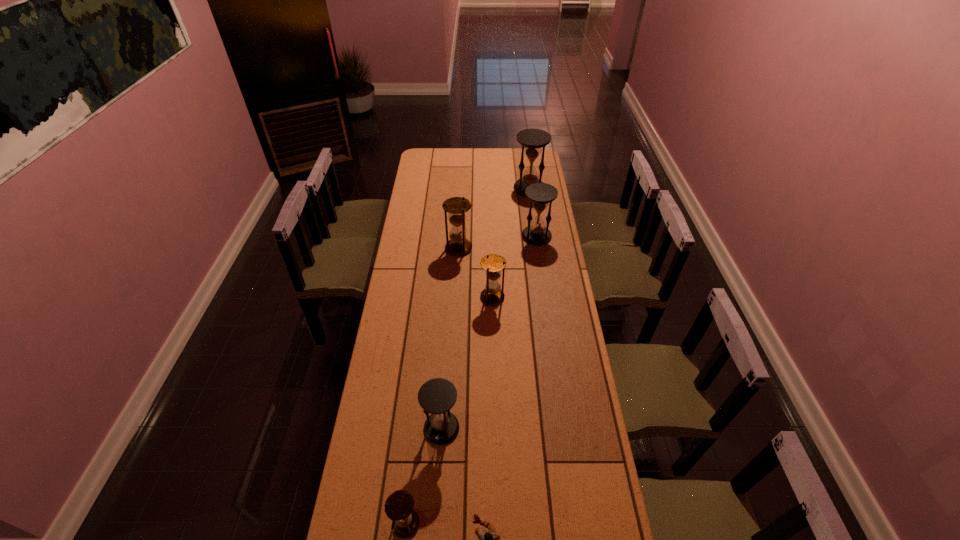
The width and height of the screenshot is (960, 540). I want to click on the farthest black hourglass, so click(x=532, y=140).

Where is `the tallest hourglass`? The height and width of the screenshot is (540, 960). the tallest hourglass is located at coordinates (532, 140).

This screenshot has height=540, width=960. In order to click on the second biggest black hourglass in this screenshot , I will do `click(537, 233)`.

Identify the location of the biggest brown hourglass. (456, 206).

Find the location of a particular element. Image resolution: width=960 pixels, height=540 pixels. the second brown hourglass from left to right is located at coordinates tap(456, 206).

Locate an element on the screen. This screenshot has width=960, height=540. the second smallest brown hourglass is located at coordinates (493, 264).

You are a GUI agent. You are given a task and a screenshot of the screen. Output one action in this format:
    pyautogui.click(x=<x>, y=<y>)
    Task: Click on the rightmost brown hourglass
    Image resolution: width=960 pixels, height=540 pixels.
    Given the screenshot: What is the action you would take?
    pyautogui.click(x=493, y=264)

Where is `the leftmost black hourglass`? The height and width of the screenshot is (540, 960). the leftmost black hourglass is located at coordinates (437, 396).

Identify the location of the third nearest object. The height and width of the screenshot is (540, 960). (437, 396).

You are a GUI agent. You are given a task and a screenshot of the screen. Output one action in this format:
    pyautogui.click(x=<x>, y=<y>)
    Task: Click on the nearest hourglass
    
    Given the screenshot: What is the action you would take?
    pyautogui.click(x=399, y=505)